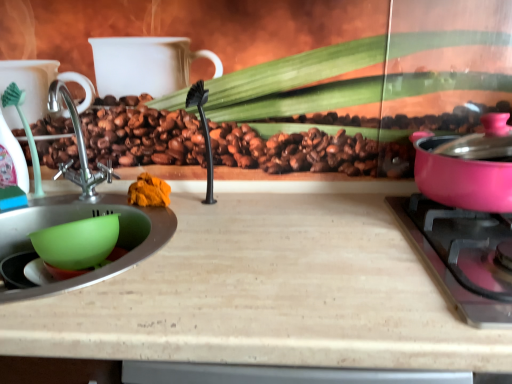
Question: From the image's perspective, is green plastic mixing bowl at lower left above wooden cutting board at center?

Choices:
 (A) no
 (B) yes

Answer: (B)

Question: Does green plastic mixing bowl at lower left have a smaller size compared to wooden cutting board at center?

Choices:
 (A) no
 (B) yes

Answer: (B)

Question: Does green plastic mixing bowl at lower left lie in front of wooden cutting board at center?

Choices:
 (A) no
 (B) yes

Answer: (A)

Question: Would you say wooden cutting board at center is part of green plastic mixing bowl at lower left's contents?

Choices:
 (A) yes
 (B) no

Answer: (B)

Question: From a real-world perspective, is green plastic mixing bowl at lower left below wooden cutting board at center?

Choices:
 (A) no
 (B) yes

Answer: (A)

Question: Is green plastic mixing bowl at lower left turned away from wooden cutting board at center?

Choices:
 (A) yes
 (B) no

Answer: (B)

Question: Would you say pink glossy pot at right is a long distance from wooden cutting board at center?

Choices:
 (A) no
 (B) yes

Answer: (A)

Question: Is pink glossy pot at right aimed at wooden cutting board at center?

Choices:
 (A) no
 (B) yes

Answer: (A)

Question: Is pink glossy pot at right to the right of wooden cutting board at center from the viewer's perspective?

Choices:
 (A) yes
 (B) no

Answer: (A)

Question: From the image's perspective, is pink glossy pot at right on wooden cutting board at center?

Choices:
 (A) no
 (B) yes

Answer: (B)

Question: From a real-world perspective, is pink glossy pot at right located beneath wooden cutting board at center?

Choices:
 (A) no
 (B) yes

Answer: (A)

Question: From the image's perspective, is pink glossy pot at right below wooden cutting board at center?

Choices:
 (A) yes
 (B) no

Answer: (B)

Question: Can we say wooden cutting board at center lies outside pink glossy pot at right?

Choices:
 (A) no
 (B) yes

Answer: (B)